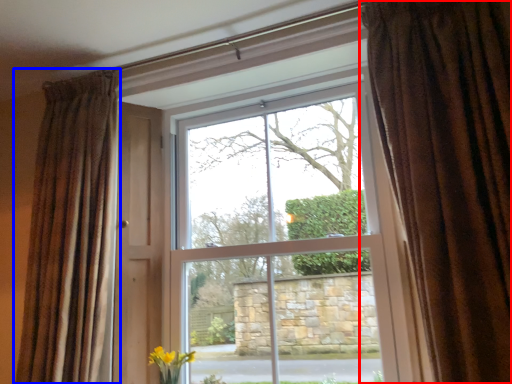
Question: Which of the following is the farthest to the observer, curtain (highlighted by a red box) or curtain (highlighted by a blue box)?

Choices:
 (A) curtain
 (B) curtain

Answer: (B)